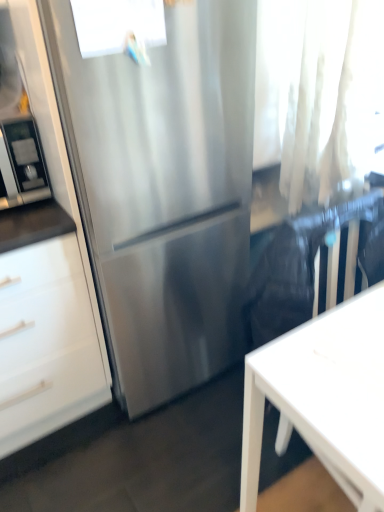
Question: Is stainless steel refrigerator at center taller than transparent glass window at upper center?

Choices:
 (A) no
 (B) yes

Answer: (B)

Question: Does stainless steel refrigerator at center lie in front of transparent glass window at upper center?

Choices:
 (A) no
 (B) yes

Answer: (B)

Question: Is stainless steel refrigerator at center bigger than transparent glass window at upper center?

Choices:
 (A) yes
 (B) no

Answer: (A)

Question: From the image's perspective, is stainless steel refrigerator at center located above transparent glass window at upper center?

Choices:
 (A) yes
 (B) no

Answer: (B)

Question: Can you confirm if stainless steel refrigerator at center is positioned to the left of transparent glass window at upper center?

Choices:
 (A) yes
 (B) no

Answer: (B)

Question: From a real-world perspective, does stainless steel refrigerator at center sit lower than transparent glass window at upper center?

Choices:
 (A) no
 (B) yes

Answer: (B)

Question: Is white matte desk at lower right oriented towards stainless steel refrigerator at center?

Choices:
 (A) no
 (B) yes

Answer: (A)

Question: Does white matte desk at lower right have a greater height compared to stainless steel refrigerator at center?

Choices:
 (A) no
 (B) yes

Answer: (A)

Question: Is white matte desk at lower right smaller than stainless steel refrigerator at center?

Choices:
 (A) no
 (B) yes

Answer: (B)

Question: From the image's perspective, is white matte desk at lower right under stainless steel refrigerator at center?

Choices:
 (A) yes
 (B) no

Answer: (A)

Question: Is white matte desk at lower right surrounding stainless steel refrigerator at center?

Choices:
 (A) yes
 (B) no

Answer: (B)

Question: Considering the relative positions of white matte desk at lower right and stainless steel refrigerator at center in the image provided, is white matte desk at lower right to the left of stainless steel refrigerator at center from the viewer's perspective?

Choices:
 (A) yes
 (B) no

Answer: (B)

Question: Is transparent glass window at upper center wider than stainless steel refrigerator at center?

Choices:
 (A) no
 (B) yes

Answer: (A)